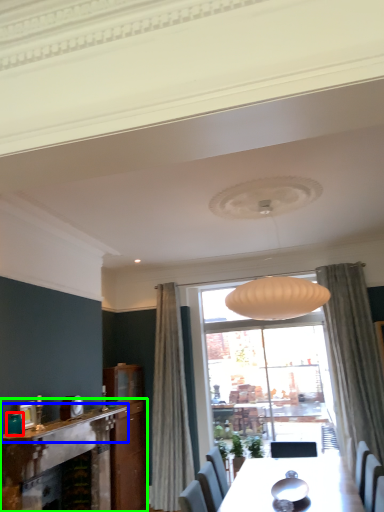
Question: Considering the real-world distances, which object is farthest from teal (highlighted by a red box)? mantle (highlighted by a blue box) or fireplace (highlighted by a green box)?

Choices:
 (A) mantle
 (B) fireplace

Answer: (B)